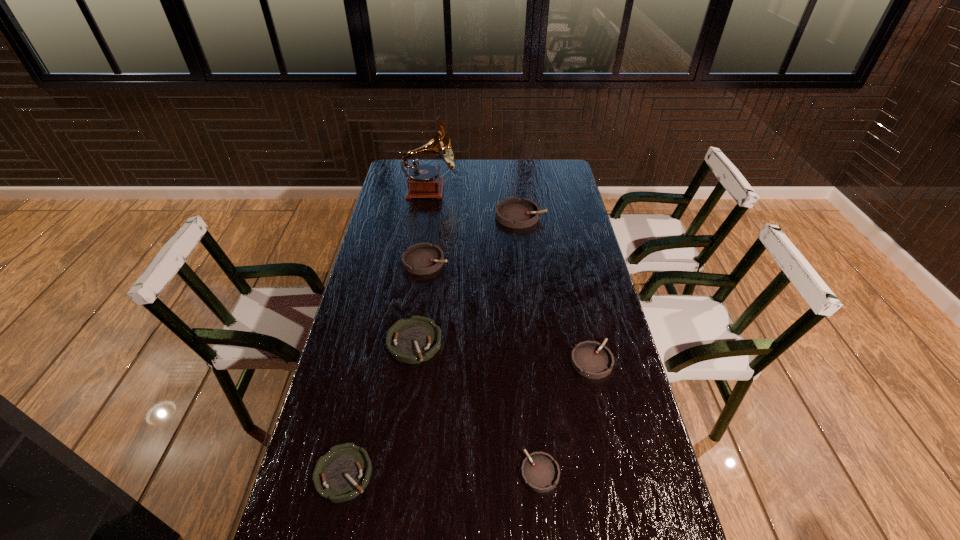
Locate an element on the screen. The width and height of the screenshot is (960, 540). vacant region between the farthest ashtray and the phonograph_record is located at coordinates (475, 202).

Locate an element on the screen. This screenshot has height=540, width=960. vacant space that is in between the biggest gray ashtray and the nearest gray ashtray is located at coordinates (530, 344).

Identify the location of vacant space in between the nearer green ashtray and the nearest gray ashtray. (442, 473).

Identify the location of vacant space in between the tallest object and the smaller green ashtray. click(x=387, y=332).

Locate which object ranks sixth in proximity to the smallest gray ashtray. Please provide its 2D coordinates. Your answer should be formatted as a tuple, i.e. [(x, y)], where the tuple contains the x and y coordinates of a point satisfying the conditions above.

[(423, 181)]

Identify which object is the fifth nearest to the third biggest gray ashtray. Please provide its 2D coordinates. Your answer should be formatted as a tuple, i.e. [(x, y)], where the tuple contains the x and y coordinates of a point satisfying the conditions above.

[(513, 212)]

Locate which ashtray is the second closest to the third farthest gray ashtray. Please provide its 2D coordinates. Your answer should be formatted as a tuple, i.e. [(x, y)], where the tuple contains the x and y coordinates of a point satisfying the conditions above.

[(416, 339)]

Locate which ashtray ranks fifth in proximity to the leftmost gray ashtray. Please provide its 2D coordinates. Your answer should be formatted as a tuple, i.e. [(x, y)], where the tuple contains the x and y coordinates of a point satisfying the conditions above.

[(540, 472)]

Locate an element on the screen. The image size is (960, 540). gray ashtray that is the closest to the phonograph_record is located at coordinates (513, 212).

Identify which gray ashtray is the second closest to the smallest gray ashtray. Please provide its 2D coordinates. Your answer should be formatted as a tuple, i.e. [(x, y)], where the tuple contains the x and y coordinates of a point satisfying the conditions above.

[(422, 258)]